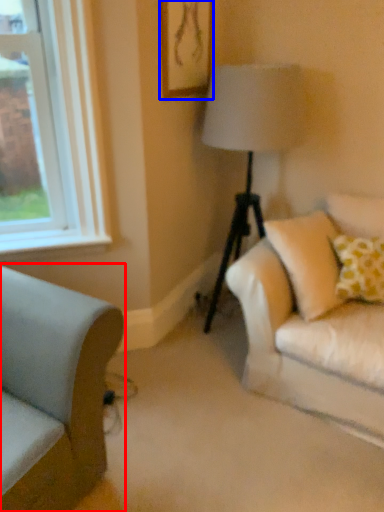
Question: Which object appears farthest to the camera in this image, studio couch (highlighted by a red box) or picture frame (highlighted by a blue box)?

Choices:
 (A) studio couch
 (B) picture frame

Answer: (B)